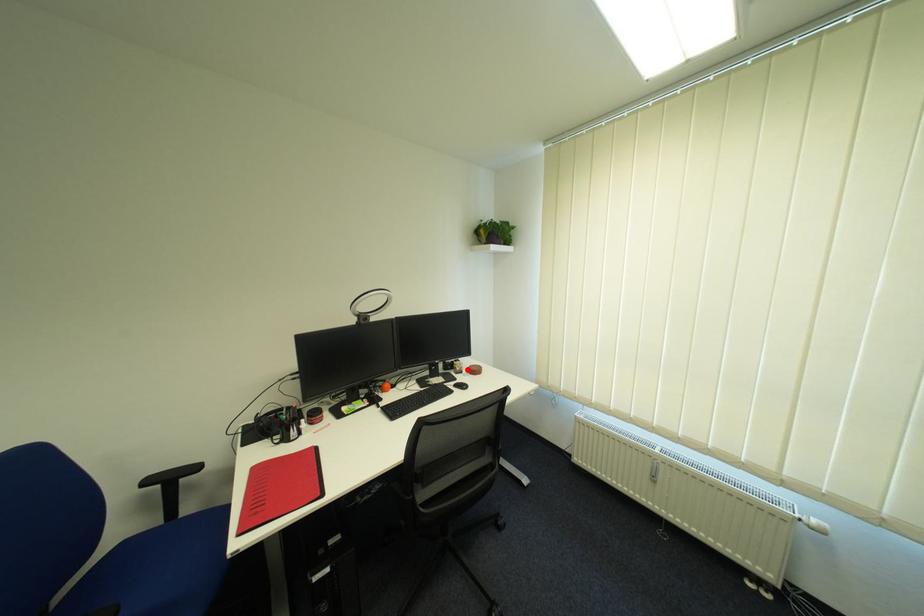
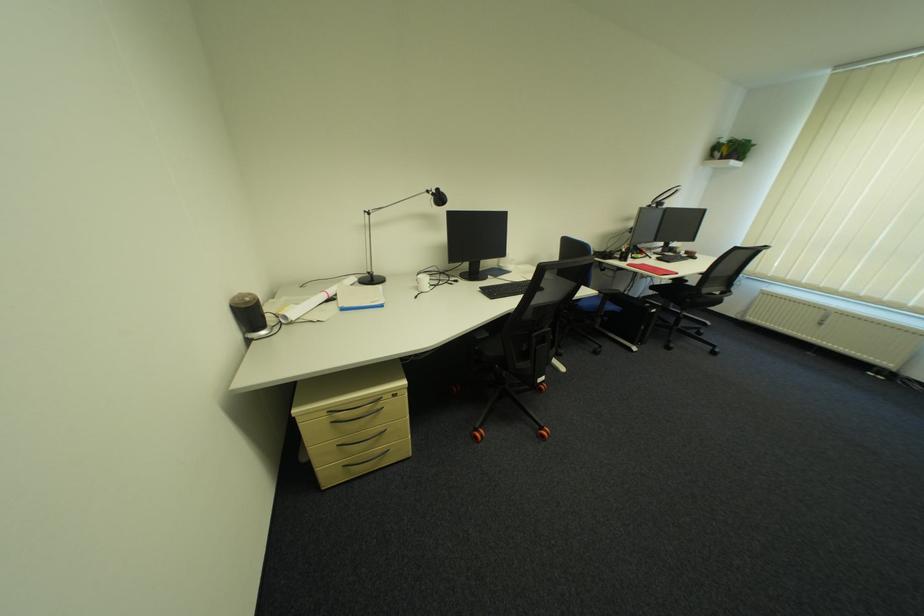
The point at the highlighted location is marked in the first image. Where is the corresponding point in the second image?

(687, 252)